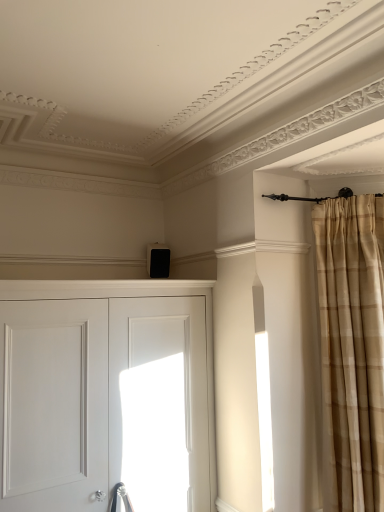
Question: Can you confirm if beige plaid curtain at right is taller than white matte door at center?

Choices:
 (A) yes
 (B) no

Answer: (A)

Question: Is beige plaid curtain at right not within white matte door at center?

Choices:
 (A) no
 (B) yes

Answer: (B)

Question: Can you confirm if beige plaid curtain at right is bigger than white matte door at center?

Choices:
 (A) no
 (B) yes

Answer: (A)

Question: Could you tell me if beige plaid curtain at right is turned towards white matte door at center?

Choices:
 (A) yes
 (B) no

Answer: (B)

Question: From the image's perspective, does beige plaid curtain at right appear lower than white matte door at center?

Choices:
 (A) no
 (B) yes

Answer: (A)

Question: Is beige plaid curtain at right not near white matte door at center?

Choices:
 (A) yes
 (B) no

Answer: (B)

Question: Does white matte door at center have a larger size compared to beige plaid curtain at right?

Choices:
 (A) no
 (B) yes

Answer: (B)

Question: Could beige plaid curtain at right be considered to be inside white matte door at center?

Choices:
 (A) no
 (B) yes

Answer: (A)

Question: Is white matte door at center closer to the viewer compared to beige plaid curtain at right?

Choices:
 (A) no
 (B) yes

Answer: (B)

Question: Does white matte door at center have a greater height compared to beige plaid curtain at right?

Choices:
 (A) yes
 (B) no

Answer: (B)

Question: Is white matte door at center oriented away from beige plaid curtain at right?

Choices:
 (A) yes
 (B) no

Answer: (B)

Question: From the image's perspective, would you say white matte door at center is shown under beige plaid curtain at right?

Choices:
 (A) yes
 (B) no

Answer: (A)

Question: From a real-world perspective, is beige plaid curtain at right positioned above or below white matte door at center?

Choices:
 (A) below
 (B) above

Answer: (B)